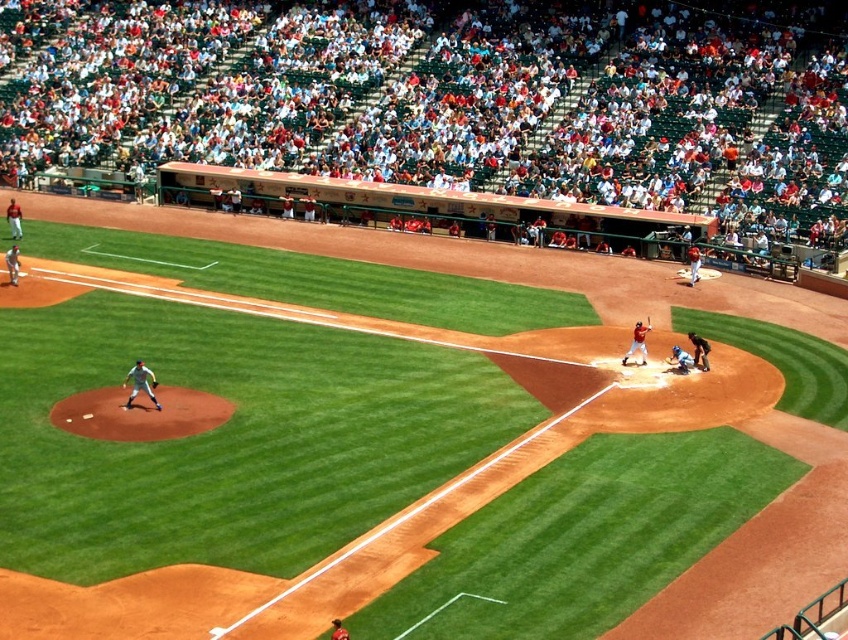
Question: Can you confirm if green grass baseball field at center is bigger than blue matte catcher at home plate?

Choices:
 (A) yes
 (B) no

Answer: (A)

Question: Can you confirm if green grass baseball field at center is smaller than brown leather glove at center?

Choices:
 (A) no
 (B) yes

Answer: (A)

Question: Estimate the real-world distances between objects in this image. Which object is farther from the white matte baseball glove at center?

Choices:
 (A) brown leather glove at center
 (B) shiny black bat at home plate
 (C) green grass baseball field at center
 (D) white fabric crowd at upper center

Answer: (D)

Question: Is green grass baseball field at center to the left of white matte baseball glove at center from the viewer's perspective?

Choices:
 (A) no
 (B) yes

Answer: (A)

Question: Which object appears farthest from the camera in this image?

Choices:
 (A) shiny black bat at home plate
 (B) brown leather glove at center

Answer: (A)

Question: Among these points, which one is nearest to the camera?

Choices:
 (A) (416, 42)
 (B) (672, 348)
 (C) (648, 317)

Answer: (B)